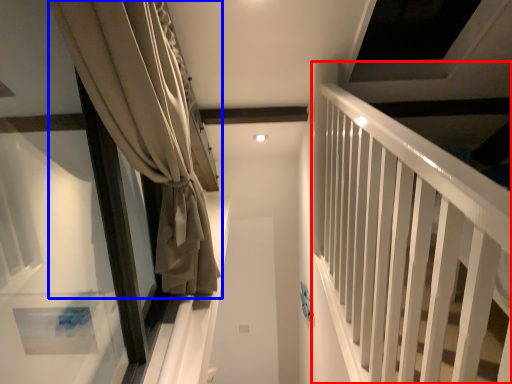
Question: Which object is further to the camera taking this photo, bunk bed (highlighted by a red box) or curtain (highlighted by a blue box)?

Choices:
 (A) bunk bed
 (B) curtain

Answer: (B)